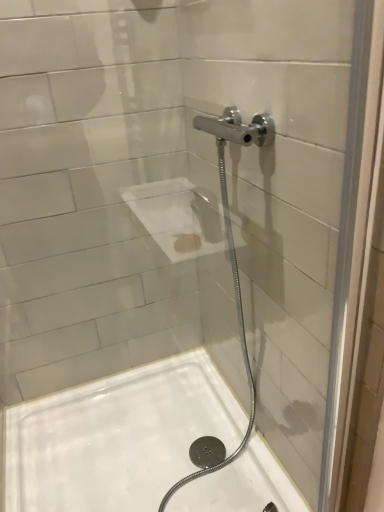
Question: Should I look upward or downward to see transparent glass door at upper center?

Choices:
 (A) up
 (B) down

Answer: (B)

Question: Would you say white glossy bath at lower left is a long distance from transparent glass door at upper center?

Choices:
 (A) yes
 (B) no

Answer: (B)

Question: Is white glossy bath at lower left thinner than transparent glass door at upper center?

Choices:
 (A) yes
 (B) no

Answer: (B)

Question: Does white glossy bath at lower left have a smaller size compared to transparent glass door at upper center?

Choices:
 (A) no
 (B) yes

Answer: (A)

Question: Does white glossy bath at lower left appear on the left side of transparent glass door at upper center?

Choices:
 (A) yes
 (B) no

Answer: (A)

Question: Can you see white glossy bath at lower left touching transparent glass door at upper center?

Choices:
 (A) yes
 (B) no

Answer: (B)

Question: From a real-world perspective, is white glossy bath at lower left beneath transparent glass door at upper center?

Choices:
 (A) no
 (B) yes

Answer: (B)

Question: Is the surface of transparent glass door at upper center in direct contact with white glossy bath at lower left?

Choices:
 (A) no
 (B) yes

Answer: (A)

Question: Is transparent glass door at upper center positioned beyond the bounds of white glossy bath at lower left?

Choices:
 (A) no
 (B) yes

Answer: (B)

Question: Considering the relative sizes of transparent glass door at upper center and white glossy bath at lower left in the image provided, is transparent glass door at upper center shorter than white glossy bath at lower left?

Choices:
 (A) yes
 (B) no

Answer: (B)

Question: Is the depth of transparent glass door at upper center greater than that of white glossy bath at lower left?

Choices:
 (A) yes
 (B) no

Answer: (B)

Question: Is transparent glass door at upper center bigger than white glossy bath at lower left?

Choices:
 (A) yes
 (B) no

Answer: (B)

Question: Can you confirm if transparent glass door at upper center is positioned to the right of white glossy bath at lower left?

Choices:
 (A) no
 (B) yes

Answer: (B)

Question: Is white glossy bath at lower left in front of or behind transparent glass door at upper center in the image?

Choices:
 (A) behind
 (B) front

Answer: (A)